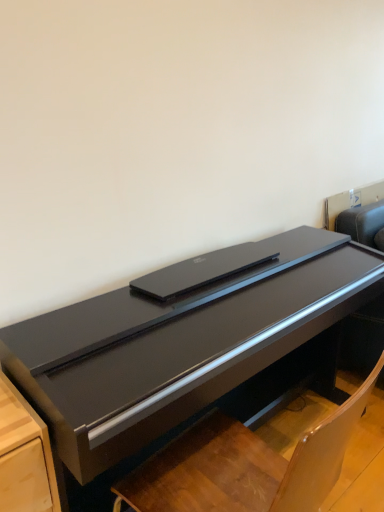
The width and height of the screenshot is (384, 512). What do you see at coordinates (176, 347) in the screenshot?
I see `glossy black desk at center` at bounding box center [176, 347].

Locate an element on the screen. Image resolution: width=384 pixels, height=512 pixels. glossy black desk at center is located at coordinates (176, 347).

The height and width of the screenshot is (512, 384). I want to click on glossy black desk at center, so coord(176,347).